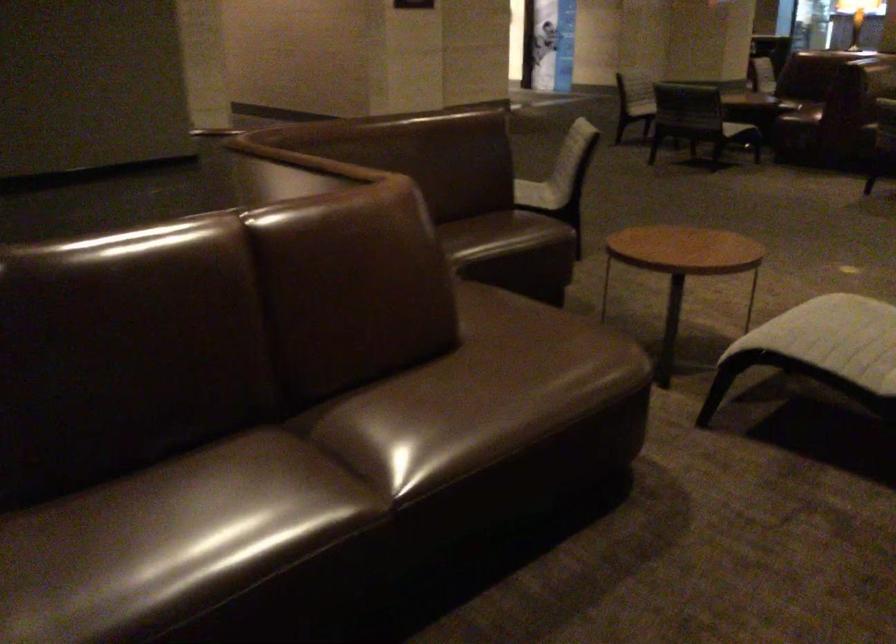
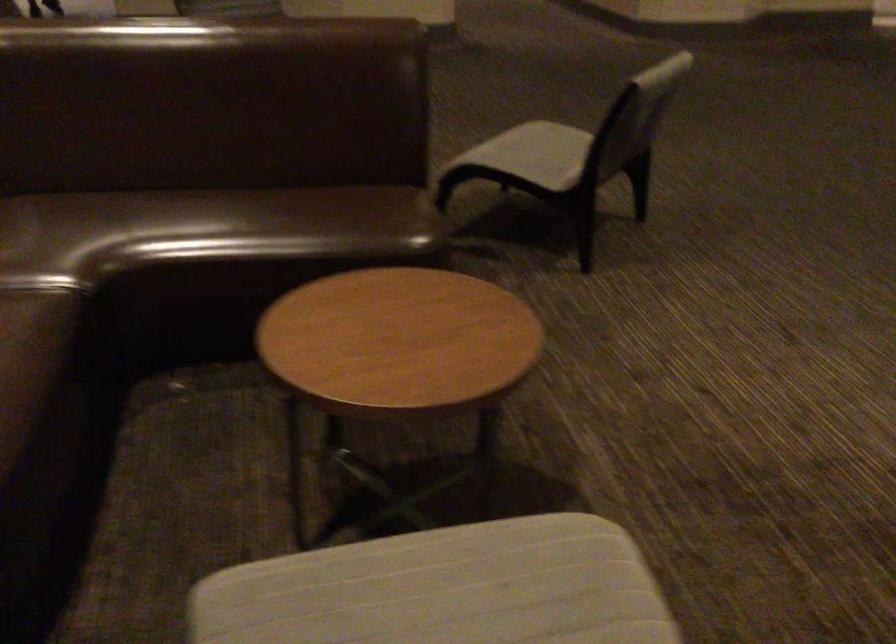
Which direction would the cameraman need to move to produce the second image?

The cameraman walked toward right, forward.